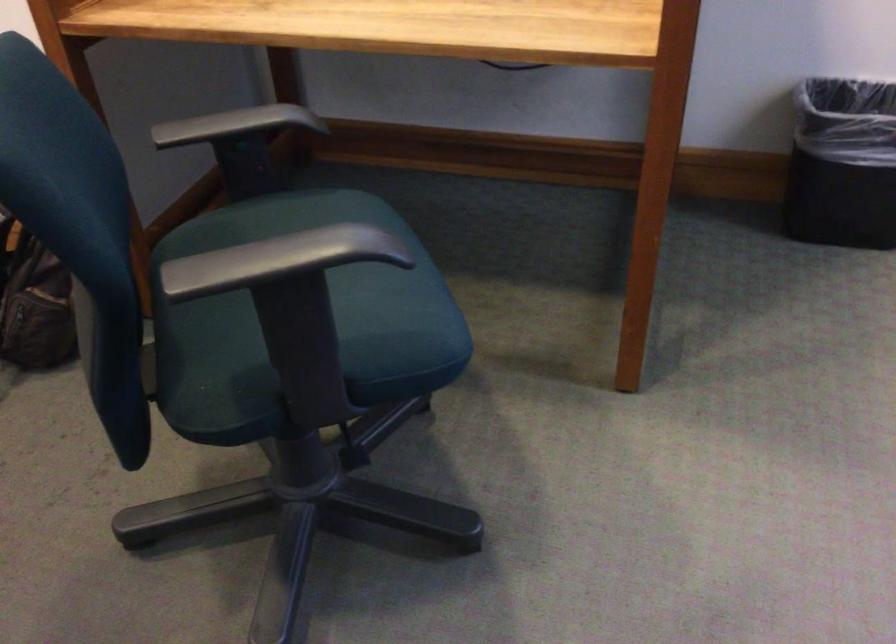
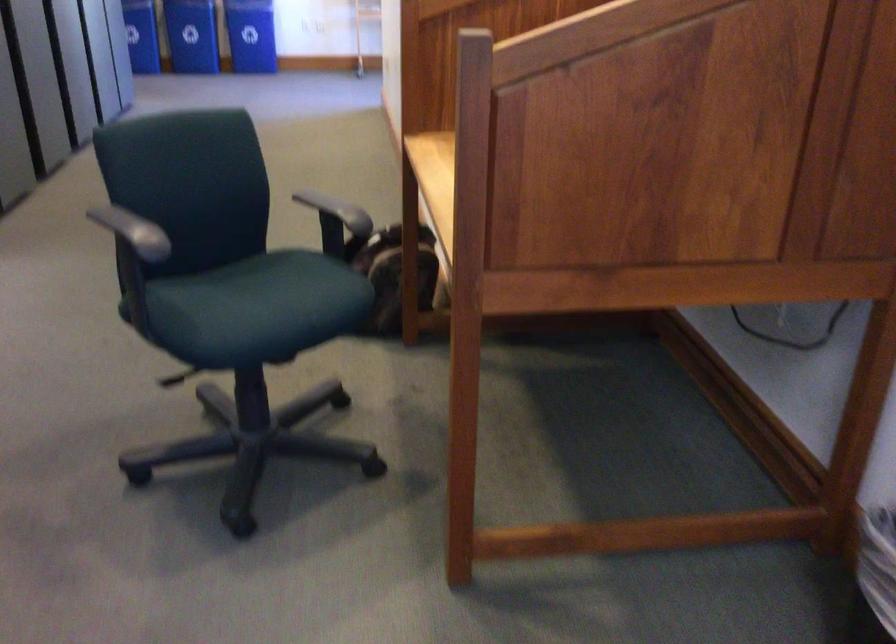
Where in the second image is the point corresponding to the point at 329,228 from the first image?

(134, 227)